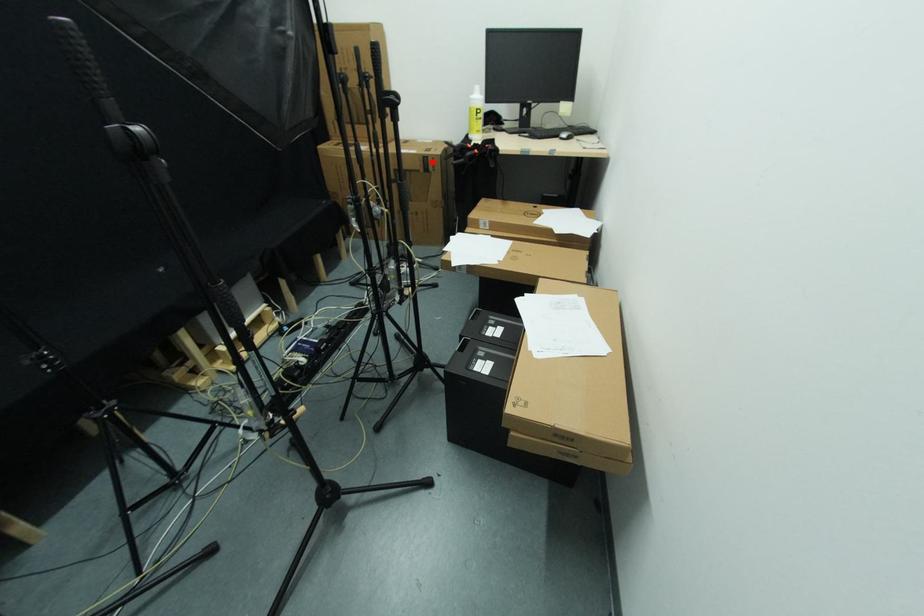
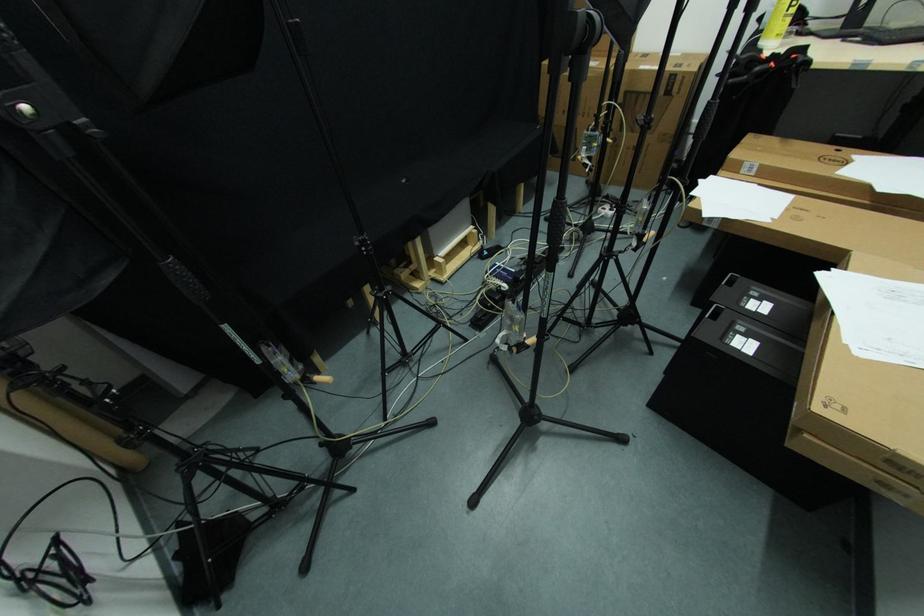
Where in the second image is the point corresponding to the highlighted location from the first image?

(679, 81)